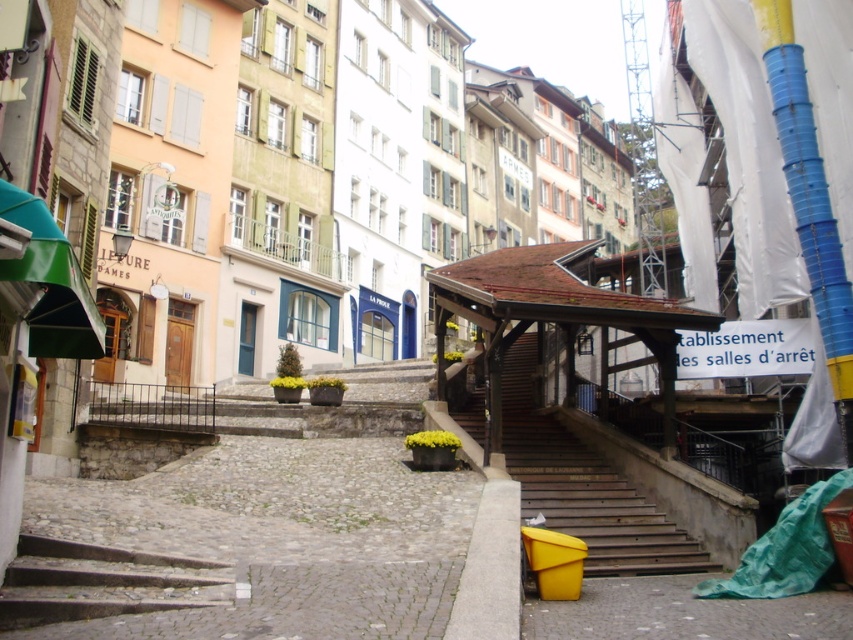
Question: Is wooden stairs at center further to camera compared to dark gray concrete stairs at lower left?

Choices:
 (A) yes
 (B) no

Answer: (A)

Question: Among these objects, which one is farthest from the camera?

Choices:
 (A) wooden stairs at center
 (B) dark gray concrete stairs at lower left

Answer: (A)

Question: Can you confirm if wooden stairs at center is positioned below dark gray concrete stairs at lower left?

Choices:
 (A) yes
 (B) no

Answer: (B)

Question: Is wooden stairs at center smaller than dark gray concrete stairs at lower left?

Choices:
 (A) no
 (B) yes

Answer: (A)